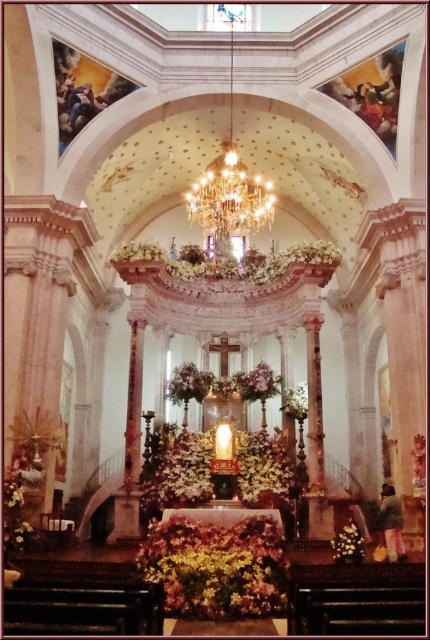
Question: Does white floral arrangement at center have a lesser width compared to pink fabric flower at center?

Choices:
 (A) yes
 (B) no

Answer: (B)

Question: Is floral bouquet at center closer to camera compared to white matte flower at center?

Choices:
 (A) no
 (B) yes

Answer: (B)

Question: Where is yellow-green fabric at lower center located in relation to floral arrangement at center in the image?

Choices:
 (A) left
 (B) right

Answer: (A)

Question: Which object appears farthest from the camera in this image?

Choices:
 (A) yellow-green fabric at lower center
 (B) shiny gold flower at lower right
 (C) pink floral arrangement at center
 (D) white matte flower at center

Answer: (D)

Question: Based on their relative distances, which object is farther from the floral arrangement at center?

Choices:
 (A) pink fabric flower at center
 (B) pink floral arrangement at center

Answer: (A)

Question: Which point is farther to the camera?

Choices:
 (A) white floral arrangement at center
 (B) floral arrangement at center
 (C) floral bouquet at center
 (D) shiny gold flower at lower right

Answer: (A)